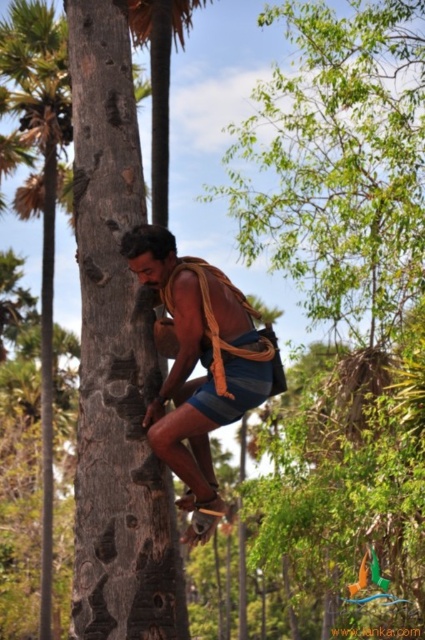
Based on the photo, you are a drone operator trying to capture a photo of the blue striped shorts at center and the brown wood palm tree at left in the scene. The camera has a maximum focus range of 30 meters. Can you capture both objects in focus simultaneously?

The blue striped shorts at center and brown wood palm tree at left are 33.95 meters apart, so the distance between them exceeds the camera maximum focus range of 30 meters. Therefore, you cannot capture both objects in focus simultaneously.

From the picture: You are a hiker trying to climb the smooth brown tree trunk at center. You notice the blue striped shorts at center nearby. Which object is bigger in size?

The smooth brown tree trunk at center is larger in size than the blue striped shorts at center.